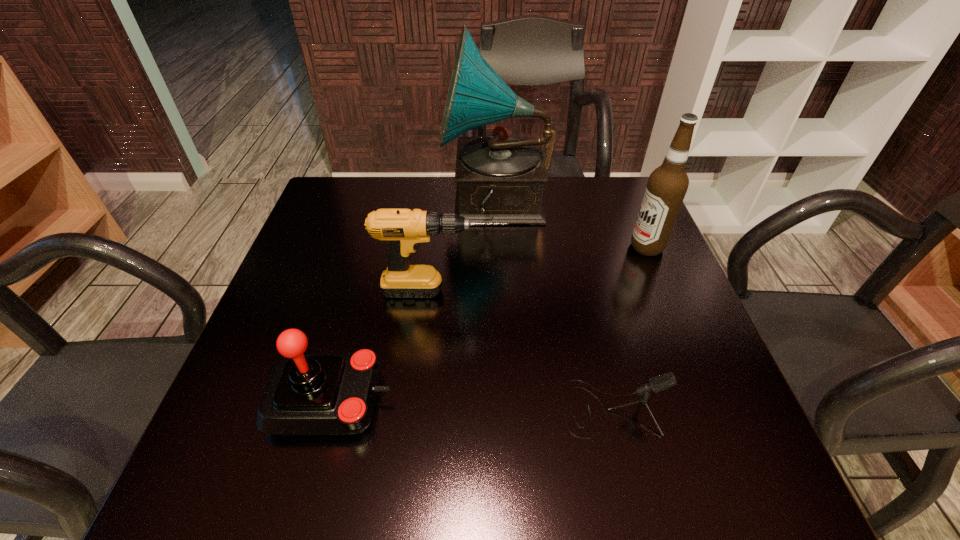
This screenshot has height=540, width=960. Identify the location of empty location between the joystick and the alcohol. (489, 323).

Identify the location of empty location between the fourth nearest object and the tallest object. The height and width of the screenshot is (540, 960). point(571,225).

The width and height of the screenshot is (960, 540). I want to click on vacant area that lies between the shortest object and the record player, so click(553, 306).

Where is `free point between the farthest object and the third tallest object`? This screenshot has width=960, height=540. free point between the farthest object and the third tallest object is located at coordinates (468, 247).

Locate an element on the screen. The height and width of the screenshot is (540, 960). vacant area that lies between the fourth tallest object and the record player is located at coordinates (413, 301).

Locate an element on the screen. Image resolution: width=960 pixels, height=540 pixels. free spot between the third farthest object and the fourth nearest object is located at coordinates (544, 269).

This screenshot has height=540, width=960. What are the coordinates of `empty space between the drill and the joystick` in the screenshot? It's located at (387, 345).

You are a GUI agent. You are given a task and a screenshot of the screen. Output one action in this format:
    pyautogui.click(x=<x>, y=<y>)
    Task: Click on the free spot between the rightmost object and the shortest object
    
    Given the screenshot: What is the action you would take?
    pyautogui.click(x=629, y=328)

Identify the location of free point between the joystick and the record player. The image size is (960, 540). (413, 301).

At what (x,y) coordinates should I click in order to perform the action: click on empty space that is in between the drill and the joystick. Please return your answer as a coordinate pair (x, y). Looking at the image, I should click on (387, 345).